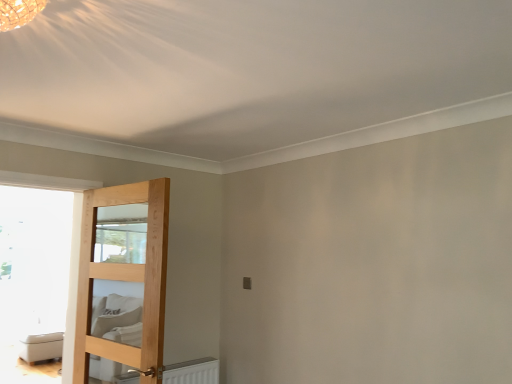
Question: Based on their sizes in the image, would you say white leather ottoman at lower left is bigger or smaller than natural wood door at left?

Choices:
 (A) big
 (B) small

Answer: (A)

Question: In terms of width, does white leather ottoman at lower left look wider or thinner when compared to natural wood door at left?

Choices:
 (A) thin
 (B) wide

Answer: (B)

Question: From the image's perspective, is white leather ottoman at lower left located above or below natural wood door at left?

Choices:
 (A) above
 (B) below

Answer: (B)

Question: From a real-world perspective, is natural wood door at left positioned above or below white leather ottoman at lower left?

Choices:
 (A) above
 (B) below

Answer: (A)

Question: Does point (87, 213) appear closer or farther from the camera than point (40, 359)?

Choices:
 (A) closer
 (B) farther

Answer: (A)

Question: Is natural wood door at left inside the boundaries of white leather ottoman at lower left, or outside?

Choices:
 (A) outside
 (B) inside

Answer: (A)

Question: From the image's perspective, is natural wood door at left located above or below white leather ottoman at lower left?

Choices:
 (A) below
 (B) above

Answer: (B)